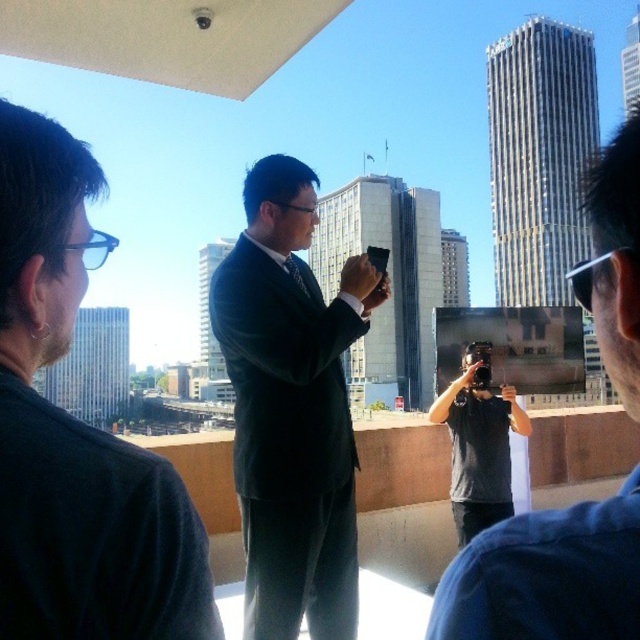
Is dark blue suit at center wider than dark gray shirt at center?

No.

Which is behind, point (246, 570) or point (627, 184)?

Point (246, 570)

At what (x,y) coordinates should I click in order to perform the action: click on dark blue suit at center. Please return your answer as a coordinate pair (x, y). The width and height of the screenshot is (640, 640). Looking at the image, I should click on (289, 442).

Is black matte suit at center below dark blue suit at center?

Actually, black matte suit at center is above dark blue suit at center.

Which is below, black matte suit at center or dark blue suit at center?

dark blue suit at center is below.

Identify the location of black matte suit at center. (76, 433).

Where is `black matte suit at center`? This screenshot has width=640, height=640. black matte suit at center is located at coordinates (76, 433).

Is dark gray shirt at center shorter than gray fabric camera at center?

No, dark gray shirt at center is not shorter than gray fabric camera at center.

Is dark gray shirt at center behind gray fabric camera at center?

No, dark gray shirt at center is in front of gray fabric camera at center.

This screenshot has height=640, width=640. Find the location of `dark gray shirt at center`. dark gray shirt at center is located at coordinates (547, 576).

This screenshot has height=640, width=640. Identify the location of dark gray shirt at center. (547, 576).